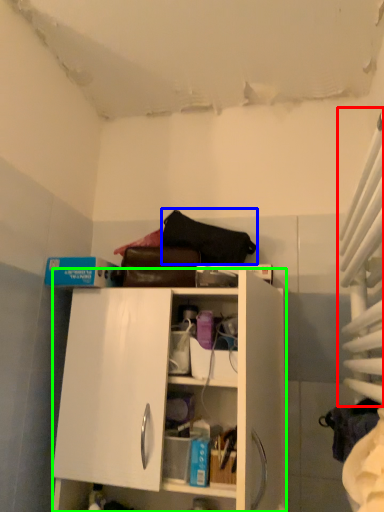
Question: Which is nearer to the curtain (highlighted by a red box)? handbag (highlighted by a blue box) or cabinetry (highlighted by a green box).

Choices:
 (A) handbag
 (B) cabinetry

Answer: (B)